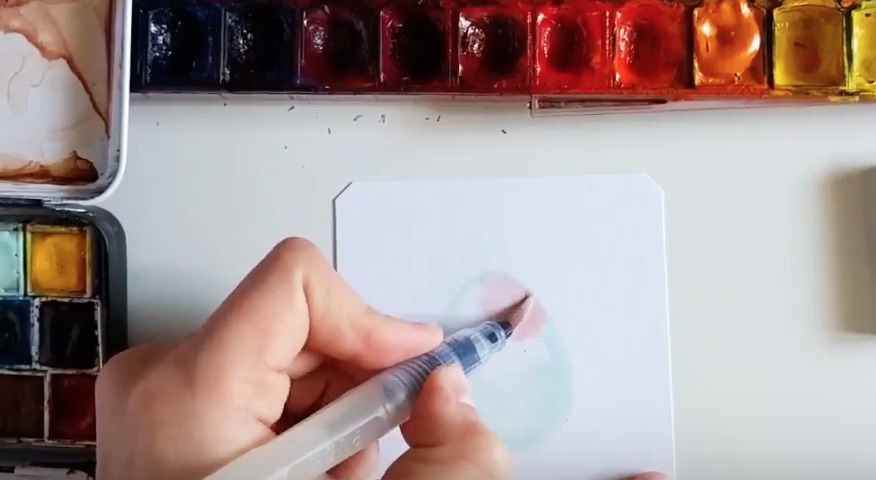
Find the location of a particular element. This screenshot has height=480, width=876. tray is located at coordinates (46, 113).